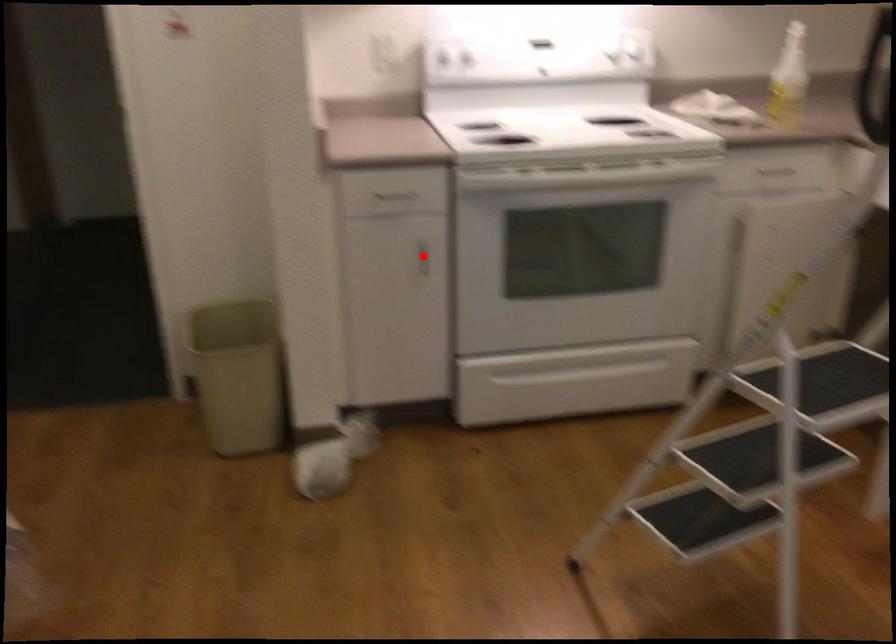
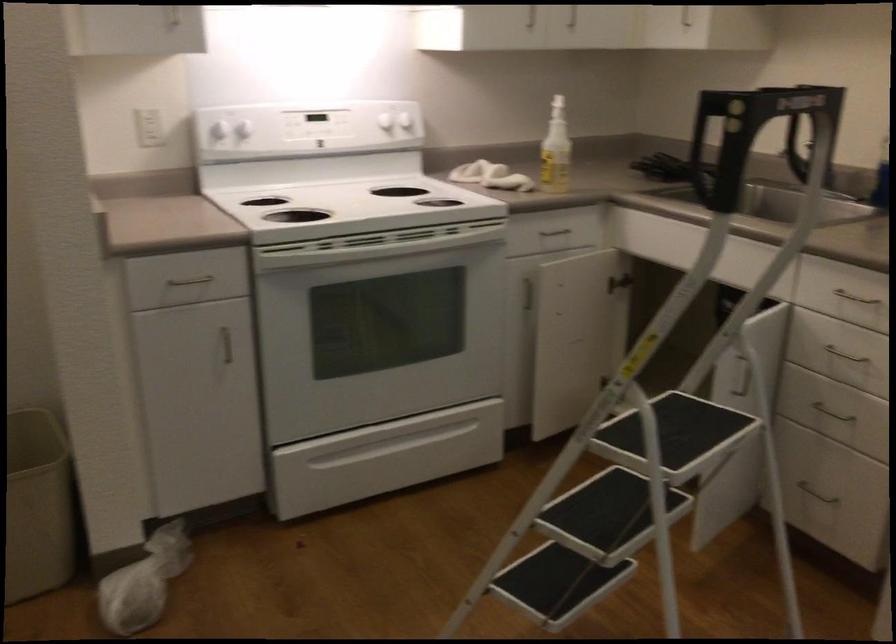
The point at the highlighted location is marked in the first image. Where is the corresponding point in the second image?

(226, 345)